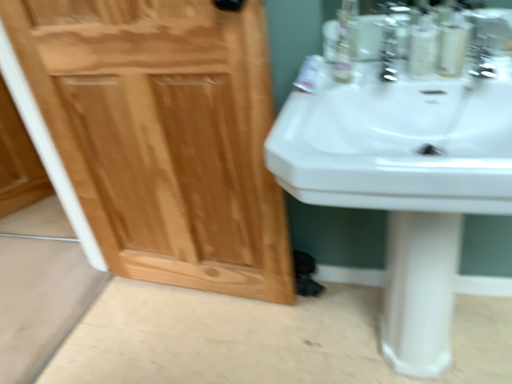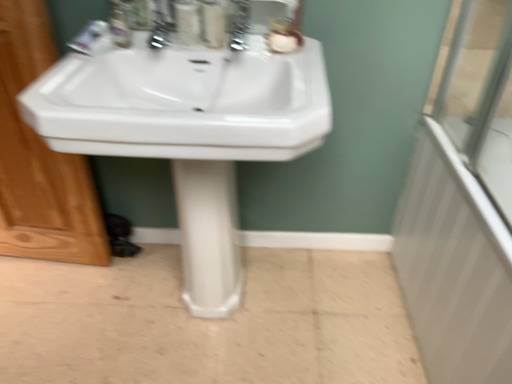
Question: Which way did the camera rotate in the video?

Choices:
 (A) rotated left
 (B) rotated right

Answer: (B)